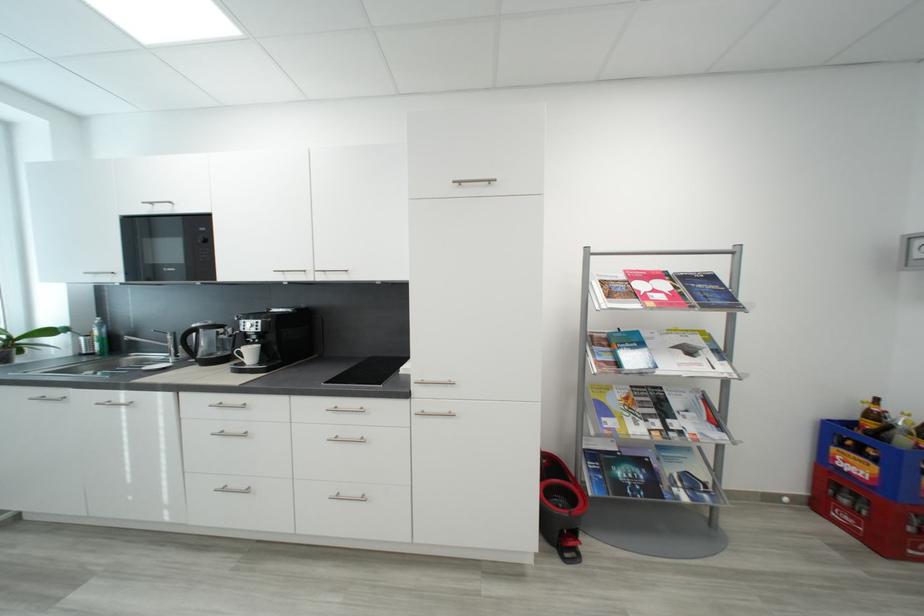
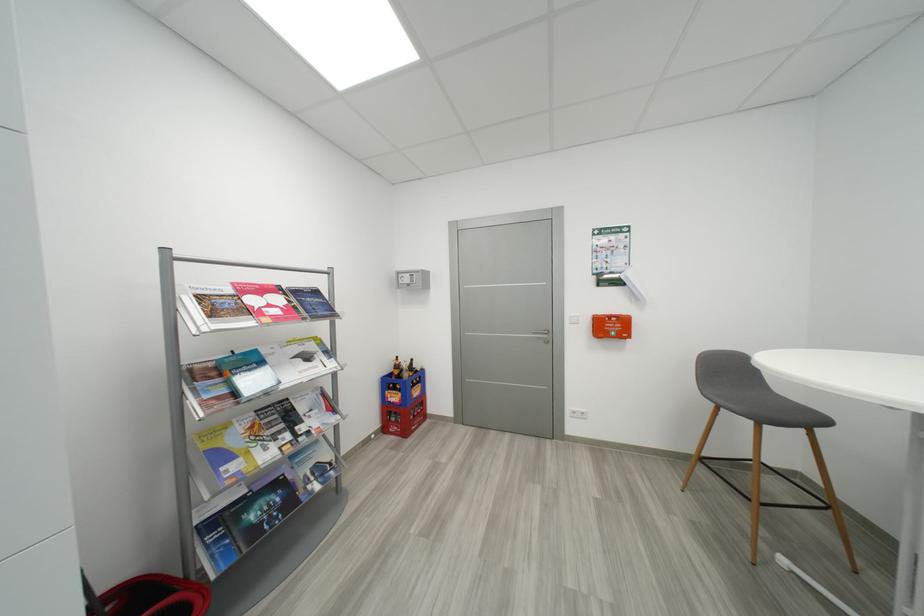
In the second image, find the point that corresponds to (881,418) in the first image.

(404, 369)